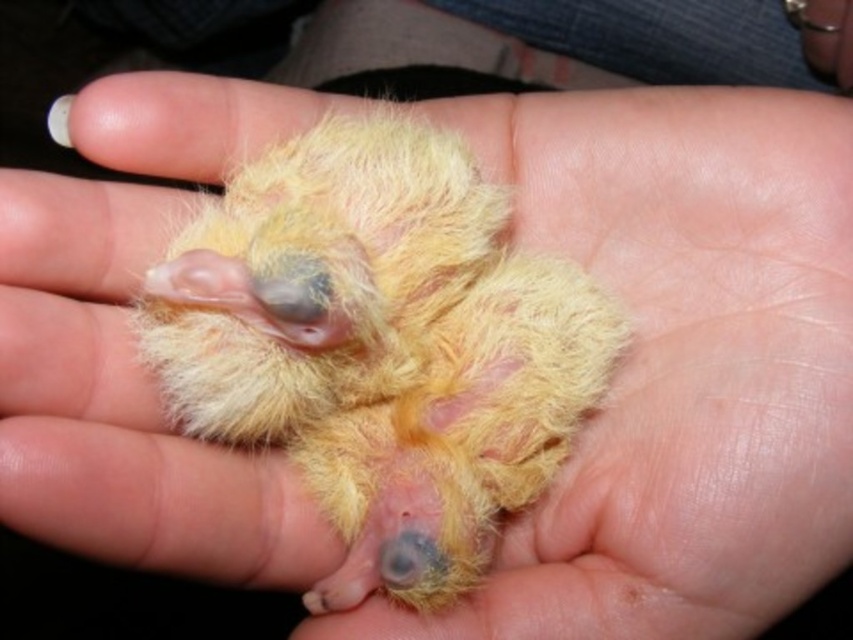
Question: Does fluffy yellow bird at center have a larger size compared to yellow downy feather at center?

Choices:
 (A) no
 (B) yes

Answer: (B)

Question: Which point is closer to the camera?

Choices:
 (A) fluffy yellow bird at center
 (B) yellow downy feather at center

Answer: (A)

Question: Does fluffy yellow bird at center have a lesser width compared to yellow downy feather at center?

Choices:
 (A) yes
 (B) no

Answer: (B)

Question: Can you confirm if fluffy yellow bird at center is wider than yellow downy feather at center?

Choices:
 (A) no
 (B) yes

Answer: (B)

Question: Among these points, which one is farthest from the camera?

Choices:
 (A) pyautogui.click(x=57, y=100)
 (B) pyautogui.click(x=296, y=276)

Answer: (A)

Question: Which point is farther to the camera?

Choices:
 (A) (61, 104)
 (B) (476, 474)

Answer: (B)